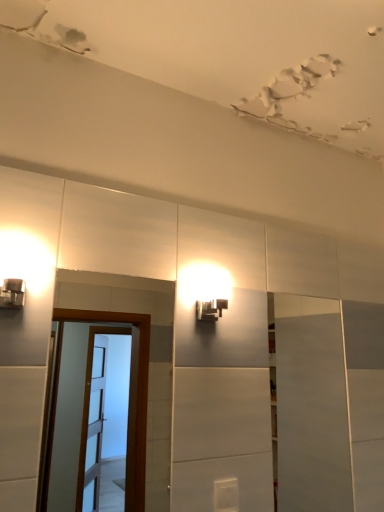
Question: From a real-world perspective, is white plastic light switch at lower center physically located above or below matte black light fixture at upper center?

Choices:
 (A) above
 (B) below

Answer: (B)

Question: Is white plastic light switch at lower center in front of or behind matte black light fixture at upper center in the image?

Choices:
 (A) behind
 (B) front

Answer: (B)

Question: Based on their relative distances, which object is nearer to the white plastic light switch at lower center?

Choices:
 (A) matte black light fixture at upper center
 (B) brown wooden screen door at left
 (C) white glossy door at right

Answer: (A)

Question: Considering the real-world distances, which object is closest to the white glossy door at right?

Choices:
 (A) matte black light fixture at upper center
 (B) white plastic light switch at lower center
 (C) brown wooden screen door at left

Answer: (B)